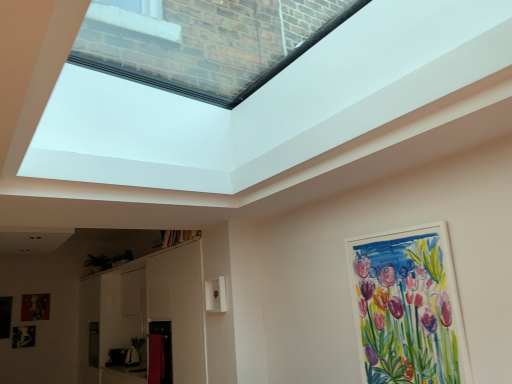
The image size is (512, 384). What do you see at coordinates (35, 307) in the screenshot?
I see `matte wooden picture frame at lower left, placed as the 2th picture frame when sorted from bottom to top` at bounding box center [35, 307].

What do you see at coordinates (172, 89) in the screenshot?
I see `transparent glass skylight at upper center` at bounding box center [172, 89].

Where is `black matte picture frame at lower left, which ranks as the 3th picture frame in top-to-bottom order`? This screenshot has height=384, width=512. black matte picture frame at lower left, which ranks as the 3th picture frame in top-to-bottom order is located at coordinates coord(23,336).

Image resolution: width=512 pixels, height=384 pixels. I want to click on white matte picture frame at upper right, marked as the third picture frame in a bottom-to-top arrangement, so click(407, 307).

From the image's perspective, is transparent glass skylight at upper center below white matte picture frame at upper right, the 1th picture frame positioned from the front?

Incorrect, from the image's perspective, transparent glass skylight at upper center is higher than white matte picture frame at upper right, the 1th picture frame positioned from the front.

Which object is positioned more to the left, transparent glass skylight at upper center or white matte picture frame at upper right, the 1th picture frame positioned from the front?

Positioned to the left is transparent glass skylight at upper center.

Which of these two, transparent glass skylight at upper center or white matte picture frame at upper right, marked as the third picture frame in a left-to-right arrangement, is thinner?

white matte picture frame at upper right, marked as the third picture frame in a left-to-right arrangement.

Is transparent glass skylight at upper center taller or shorter than white matte picture frame at upper right, marked as the third picture frame in a bottom-to-top arrangement?

transparent glass skylight at upper center is shorter than white matte picture frame at upper right, marked as the third picture frame in a bottom-to-top arrangement.

Identify the location of picture frame that appears above the matte wooden picture frame at lower left, which appears as the 2th picture frame when viewed from the right (from the image's perspective). This screenshot has height=384, width=512. [x=407, y=307].

From the image's perspective, would you say matte wooden picture frame at lower left, placed as the 2th picture frame when sorted from bottom to top, is shown under white matte picture frame at upper right, which appears as the first picture frame when viewed from the top?

Yes, from the image's perspective, matte wooden picture frame at lower left, placed as the 2th picture frame when sorted from bottom to top, is below white matte picture frame at upper right, which appears as the first picture frame when viewed from the top.

Is matte wooden picture frame at lower left, marked as the third picture frame in a front-to-back arrangement, taller or shorter than white matte picture frame at upper right, marked as the third picture frame in a left-to-right arrangement?

In the image, matte wooden picture frame at lower left, marked as the third picture frame in a front-to-back arrangement, appears to be shorter than white matte picture frame at upper right, marked as the third picture frame in a left-to-right arrangement.

Which is more distant, (24, 318) or (356, 308)?

Positioned behind is point (24, 318).

From a real-world perspective, is transparent glass skylight at upper center positioned over black matte picture frame at lower left, which appears as the 3th picture frame when viewed from the right, based on gravity?

Yes, from a real-world perspective, transparent glass skylight at upper center is over black matte picture frame at lower left, which appears as the 3th picture frame when viewed from the right

Between transparent glass skylight at upper center and black matte picture frame at lower left, which ranks as the 3th picture frame in top-to-bottom order, which one has smaller width?

black matte picture frame at lower left, which ranks as the 3th picture frame in top-to-bottom order.

Considering the relative positions of transparent glass skylight at upper center and black matte picture frame at lower left, which is the 2th picture frame in front-to-back order, in the image provided, is transparent glass skylight at upper center to the right of black matte picture frame at lower left, which is the 2th picture frame in front-to-back order, from the viewer's perspective?

Correct, you'll find transparent glass skylight at upper center to the right of black matte picture frame at lower left, which is the 2th picture frame in front-to-back order.

Is transparent glass skylight at upper center far away from black matte picture frame at lower left, which is counted as the 1th picture frame, starting from the bottom?

transparent glass skylight at upper center is positioned a significant distance from black matte picture frame at lower left, which is counted as the 1th picture frame, starting from the bottom.

Based on their positions, is black matte picture frame at lower left, which ranks as the 3th picture frame in top-to-bottom order, located to the left or right of white matte picture frame at upper right, marked as the third picture frame in a left-to-right arrangement?

Based on their positions, black matte picture frame at lower left, which ranks as the 3th picture frame in top-to-bottom order, is located to the left of white matte picture frame at upper right, marked as the third picture frame in a left-to-right arrangement.

Which is farther from the camera, (19, 346) or (379, 233)?

The point (19, 346) is farther.

Considering the sizes of objects black matte picture frame at lower left, which ranks as the 3th picture frame in top-to-bottom order, and white matte picture frame at upper right, marked as the third picture frame in a left-to-right arrangement, in the image provided, who is wider, black matte picture frame at lower left, which ranks as the 3th picture frame in top-to-bottom order, or white matte picture frame at upper right, marked as the third picture frame in a left-to-right arrangement,?

With larger width is white matte picture frame at upper right, marked as the third picture frame in a left-to-right arrangement.

Is black matte picture frame at lower left, placed as the second picture frame when sorted from back to front, taller than white matte picture frame at upper right, which appears as the first picture frame when viewed from the top?

No, black matte picture frame at lower left, placed as the second picture frame when sorted from back to front, is not taller than white matte picture frame at upper right, which appears as the first picture frame when viewed from the top.

Does transparent glass skylight at upper center have a greater width compared to matte wooden picture frame at lower left, marked as the first picture frame in a back-to-front arrangement?

Yes, transparent glass skylight at upper center is wider than matte wooden picture frame at lower left, marked as the first picture frame in a back-to-front arrangement.

Does transparent glass skylight at upper center appear on the right side of matte wooden picture frame at lower left, which is counted as the second picture frame, starting from the top?

Yes, transparent glass skylight at upper center is to the right of matte wooden picture frame at lower left, which is counted as the second picture frame, starting from the top.

From their relative heights in the image, would you say transparent glass skylight at upper center is taller or shorter than matte wooden picture frame at lower left, marked as the third picture frame in a front-to-back arrangement?

Considering their sizes, transparent glass skylight at upper center has less height than matte wooden picture frame at lower left, marked as the third picture frame in a front-to-back arrangement.

Locate an element on the screen. The height and width of the screenshot is (384, 512). picture frame that is the 1st object to the left of the transparent glass skylight at upper center, starting at the anchor is located at coordinates (35, 307).

Is matte wooden picture frame at lower left, placed as the 2th picture frame when sorted from left to right, turned away from transparent glass skylight at upper center?

No, matte wooden picture frame at lower left, placed as the 2th picture frame when sorted from left to right, is not facing the opposite direction of transparent glass skylight at upper center.

How different are the orientations of matte wooden picture frame at lower left, which is counted as the second picture frame, starting from the top, and transparent glass skylight at upper center in degrees?

The facing directions of matte wooden picture frame at lower left, which is counted as the second picture frame, starting from the top, and transparent glass skylight at upper center are 178 degrees apart.

From the image's perspective, is matte wooden picture frame at lower left, marked as the first picture frame in a back-to-front arrangement, positioned above or below transparent glass skylight at upper center?

Clearly, from the image's perspective, matte wooden picture frame at lower left, marked as the first picture frame in a back-to-front arrangement, is below transparent glass skylight at upper center.

Does matte wooden picture frame at lower left, placed as the 2th picture frame when sorted from bottom to top, have a greater width compared to transparent glass skylight at upper center?

No.

Measure the distance between matte wooden picture frame at lower left, which appears as the 2th picture frame when viewed from the right, and black matte picture frame at lower left, which is the 2th picture frame in front-to-back order.

matte wooden picture frame at lower left, which appears as the 2th picture frame when viewed from the right, and black matte picture frame at lower left, which is the 2th picture frame in front-to-back order, are 8.81 inches apart from each other.

Considering the relative positions of matte wooden picture frame at lower left, placed as the 2th picture frame when sorted from bottom to top, and black matte picture frame at lower left, which is the 2th picture frame in front-to-back order, in the image provided, is matte wooden picture frame at lower left, placed as the 2th picture frame when sorted from bottom to top, to the left of black matte picture frame at lower left, which is the 2th picture frame in front-to-back order, from the viewer's perspective?

Incorrect, matte wooden picture frame at lower left, placed as the 2th picture frame when sorted from bottom to top, is not on the left side of black matte picture frame at lower left, which is the 2th picture frame in front-to-back order.

Find the location of a particular element. Image resolution: width=512 pixels, height=384 pixels. picture frame below the matte wooden picture frame at lower left, which is counted as the second picture frame, starting from the top (from the image's perspective) is located at coordinates (23, 336).

Is matte wooden picture frame at lower left, which is counted as the second picture frame, starting from the top, smaller than black matte picture frame at lower left, which is the 2th picture frame in front-to-back order?

Incorrect, matte wooden picture frame at lower left, which is counted as the second picture frame, starting from the top, is not smaller in size than black matte picture frame at lower left, which is the 2th picture frame in front-to-back order.

This screenshot has width=512, height=384. I want to click on window screen above the white matte picture frame at upper right, which appears as the 1th picture frame when viewed from the right (from a real-world perspective), so click(172, 89).

Locate an element on the screen. The image size is (512, 384). the 1st picture frame below when counting from the white matte picture frame at upper right, marked as the third picture frame in a left-to-right arrangement (from the image's perspective) is located at coordinates (35, 307).

Considering their positions, is black matte picture frame at lower left, which is the 2th picture frame in front-to-back order, positioned further to matte wooden picture frame at lower left, which appears as the 2th picture frame when viewed from the right, than white matte picture frame at upper right, marked as the third picture frame in a left-to-right arrangement?

white matte picture frame at upper right, marked as the third picture frame in a left-to-right arrangement, is further to matte wooden picture frame at lower left, which appears as the 2th picture frame when viewed from the right.

Estimate the real-world distances between objects in this image. Which object is further from matte wooden picture frame at lower left, which appears as the 2th picture frame when viewed from the right, white matte picture frame at upper right, which appears as the first picture frame when viewed from the top, or transparent glass skylight at upper center?

white matte picture frame at upper right, which appears as the first picture frame when viewed from the top, is further to matte wooden picture frame at lower left, which appears as the 2th picture frame when viewed from the right.

Looking at the image, which one is located further to black matte picture frame at lower left, which is the 2th picture frame in front-to-back order, matte wooden picture frame at lower left, which is counted as the second picture frame, starting from the top, or white matte picture frame at upper right, marked as the third picture frame in a bottom-to-top arrangement?

The object further to black matte picture frame at lower left, which is the 2th picture frame in front-to-back order, is white matte picture frame at upper right, marked as the third picture frame in a bottom-to-top arrangement.

Which object lies further to the anchor point white matte picture frame at upper right, the 1th picture frame positioned from the front, matte wooden picture frame at lower left, placed as the 2th picture frame when sorted from left to right, or transparent glass skylight at upper center?

matte wooden picture frame at lower left, placed as the 2th picture frame when sorted from left to right, lies further to white matte picture frame at upper right, the 1th picture frame positioned from the front, than the other object.

Based on their spatial positions, is transparent glass skylight at upper center or matte wooden picture frame at lower left, which appears as the 2th picture frame when viewed from the right, further from black matte picture frame at lower left, which ranks as the 3th picture frame in top-to-bottom order?

transparent glass skylight at upper center.

Based on the photo, estimate the real-world distances between objects in this image. Which object is further from white matte picture frame at upper right, marked as the third picture frame in a bottom-to-top arrangement, transparent glass skylight at upper center or matte wooden picture frame at lower left, placed as the 2th picture frame when sorted from bottom to top?

matte wooden picture frame at lower left, placed as the 2th picture frame when sorted from bottom to top, is further to white matte picture frame at upper right, marked as the third picture frame in a bottom-to-top arrangement.

Looking at the image, which one is located further to transparent glass skylight at upper center, black matte picture frame at lower left, which appears as the 3th picture frame when viewed from the right, or white matte picture frame at upper right, which appears as the first picture frame when viewed from the top?

Among the two, black matte picture frame at lower left, which appears as the 3th picture frame when viewed from the right, is located further to transparent glass skylight at upper center.

Estimate the real-world distances between objects in this image. Which object is further from matte wooden picture frame at lower left, placed as the 2th picture frame when sorted from bottom to top, white matte picture frame at upper right, the third picture frame viewed from the back, or black matte picture frame at lower left, which ranks as the 3th picture frame in top-to-bottom order?

Based on the image, white matte picture frame at upper right, the third picture frame viewed from the back, appears to be further to matte wooden picture frame at lower left, placed as the 2th picture frame when sorted from bottom to top.

Where is `picture frame between transparent glass skylight at upper center and black matte picture frame at lower left, placed as the second picture frame when sorted from back to front, in the front-back direction`? picture frame between transparent glass skylight at upper center and black matte picture frame at lower left, placed as the second picture frame when sorted from back to front, in the front-back direction is located at coordinates (407, 307).

The width and height of the screenshot is (512, 384). What are the coordinates of `picture frame positioned between white matte picture frame at upper right, which appears as the first picture frame when viewed from the top, and matte wooden picture frame at lower left, marked as the first picture frame in a back-to-front arrangement, from near to far` in the screenshot? It's located at (23, 336).